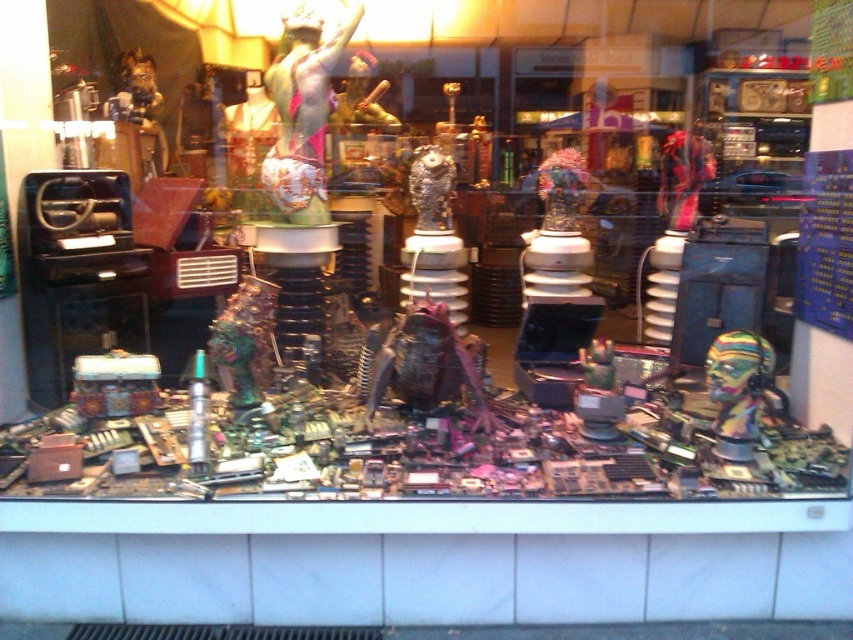
Between metallic green statue at center and multicolored plastic head at center, which one appears on the right side from the viewer's perspective?

Positioned to the right is multicolored plastic head at center.

Does metallic green statue at center have a greater width compared to multicolored plastic head at center?

Yes, metallic green statue at center is wider than multicolored plastic head at center.

Which is in front, point (321, 216) or point (753, 406)?

Point (753, 406)

Where is `metallic green statue at center`? metallic green statue at center is located at coordinates (302, 115).